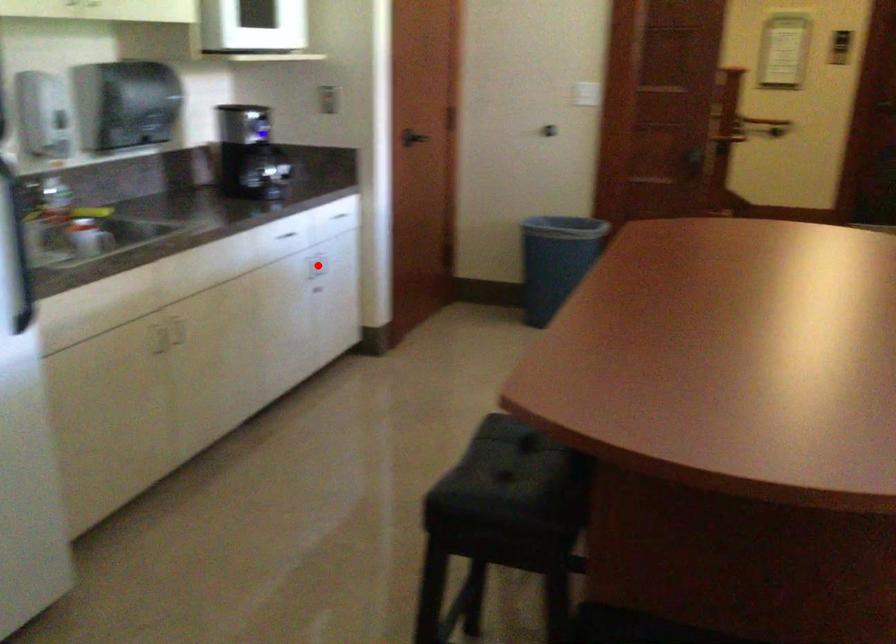
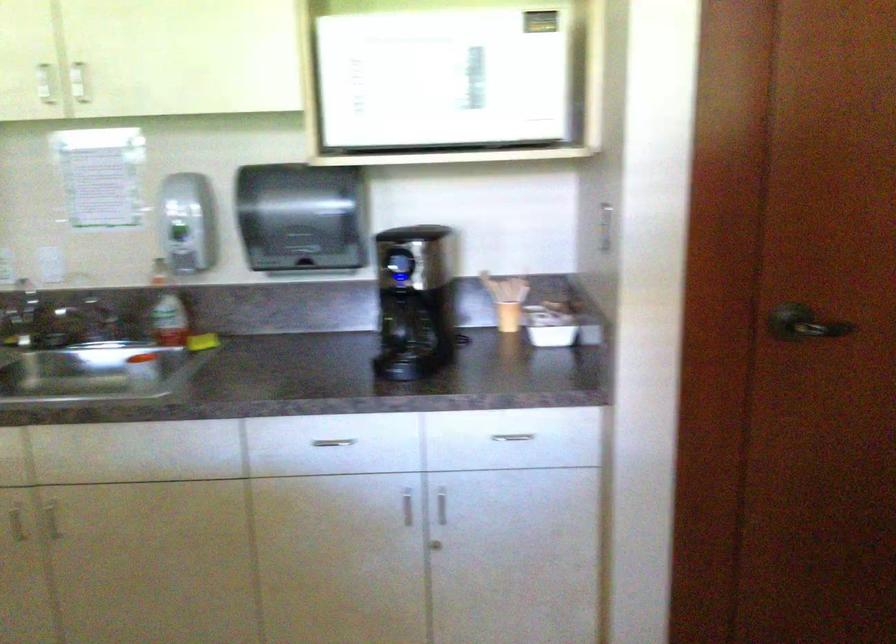
In the second image, find the point that corresponds to the highlighted location in the first image.

(442, 506)